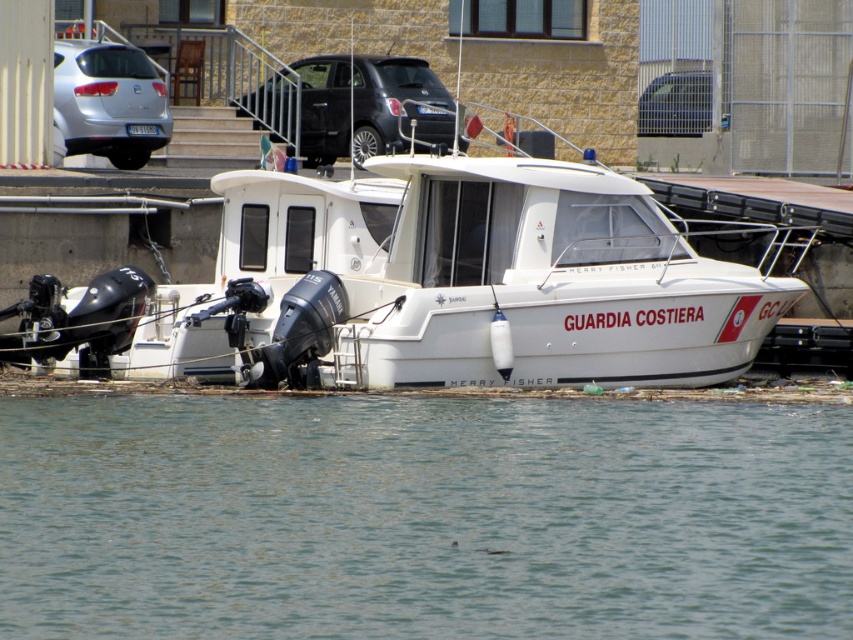
Question: Among these objects, which one is farthest from the camera?

Choices:
 (A) silver metallic car at upper left
 (B) clear water at center
 (C) metallic silver car at upper center

Answer: (C)

Question: Which object appears closest to the camera in this image?

Choices:
 (A) clear water at center
 (B) black matte car at upper center
 (C) white glossy boat at center

Answer: (A)

Question: Considering the relative positions of black matte car at upper center and metallic silver car at upper center in the image provided, where is black matte car at upper center located with respect to metallic silver car at upper center?

Choices:
 (A) right
 (B) left

Answer: (B)

Question: Does clear water at center have a smaller size compared to silver metallic car at upper left?

Choices:
 (A) no
 (B) yes

Answer: (A)

Question: Does white glossy boat at center appear on the right side of silver metallic car at upper left?

Choices:
 (A) yes
 (B) no

Answer: (A)

Question: Which point is closer to the camera?

Choices:
 (A) black matte car at upper center
 (B) clear water at center

Answer: (B)